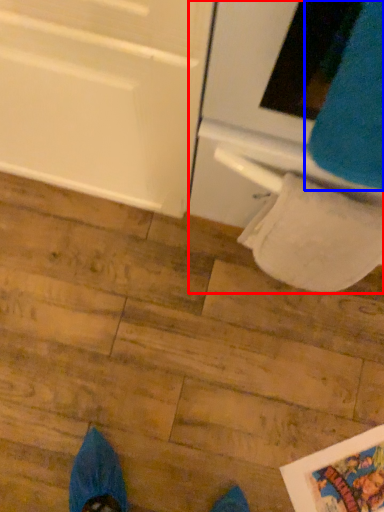
Question: Which object is further to the camera taking this photo, oven (highlighted by a red box) or sweat pant (highlighted by a blue box)?

Choices:
 (A) oven
 (B) sweat pant

Answer: (A)